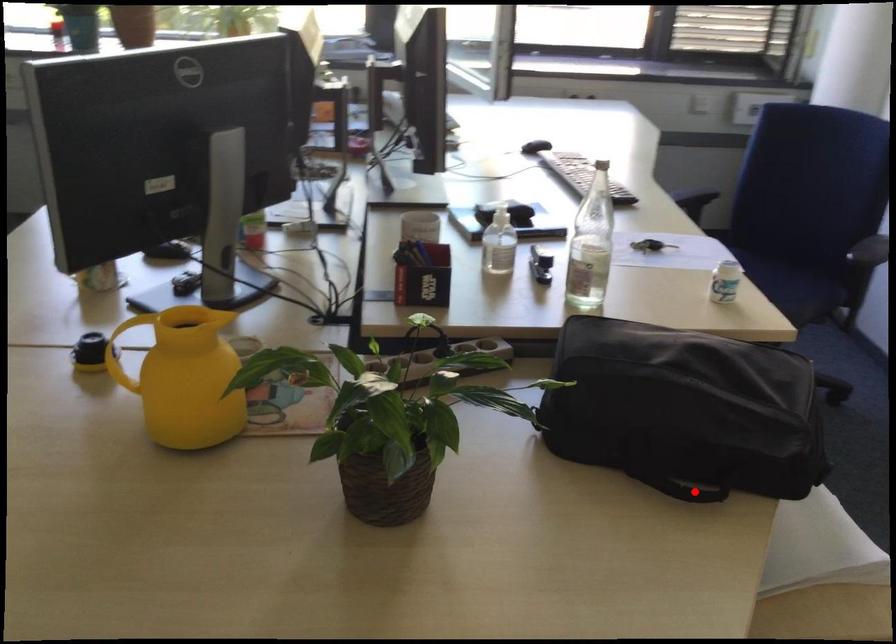
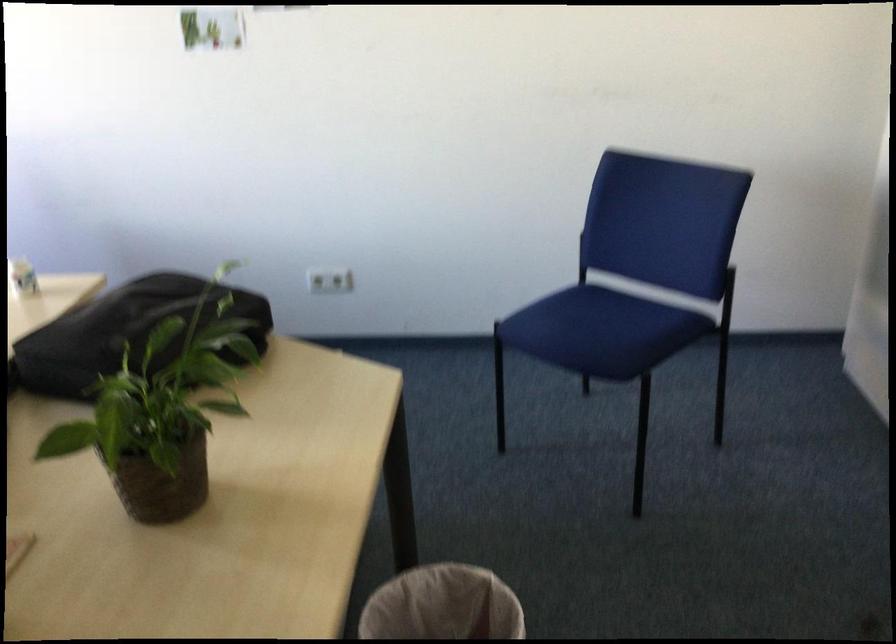
Question: I am providing you with two images of the same scene from different viewpoints. A red point is marked on the first image. Can you still see the location of the red point in image 2?

Choices:
 (A) Yes
 (B) No

Answer: (B)